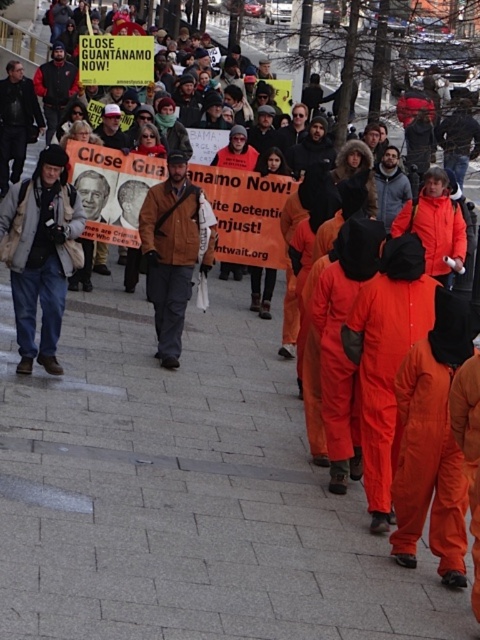
Question: Is matte beige jacket at center to the right of matte black jacket at left from the viewer's perspective?

Choices:
 (A) no
 (B) yes

Answer: (B)

Question: Which point appears farthest from the camera in this image?

Choices:
 (A) (41, 220)
 (B) (168, 220)
 (C) (12, 125)

Answer: (C)

Question: Estimate the real-world distances between objects in this image. Which object is farther from the matte beige jacket at center?

Choices:
 (A) matte black jacket at left
 (B) brown leather jacket at center

Answer: (A)

Question: Where is matte beige jacket at center located in relation to matte black jacket at left in the image?

Choices:
 (A) above
 (B) below

Answer: (B)

Question: Which object appears closest to the camera in this image?

Choices:
 (A) brown leather jacket at center
 (B) matte beige jacket at center
 (C) matte black jacket at left

Answer: (B)

Question: Is brown leather jacket at center above matte black jacket at left?

Choices:
 (A) yes
 (B) no

Answer: (B)